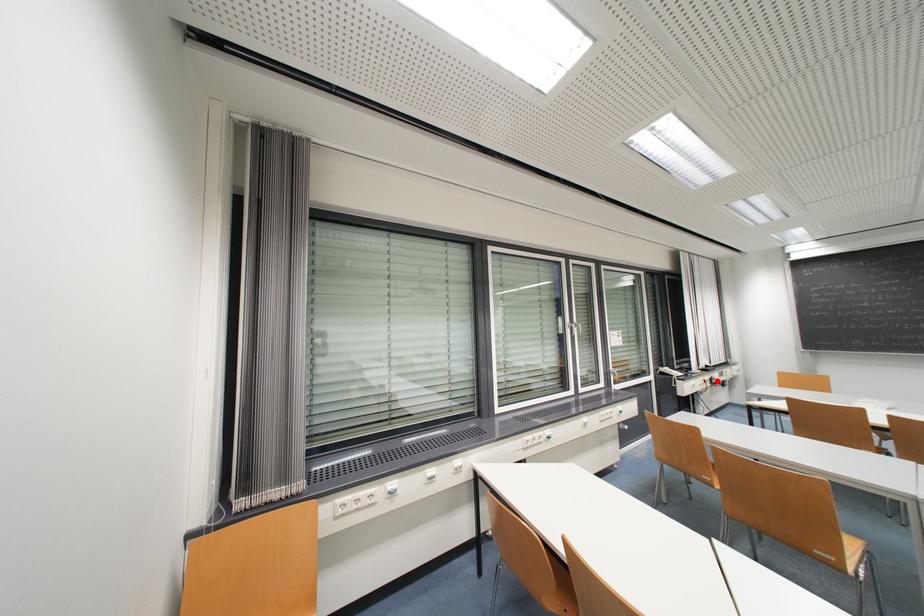
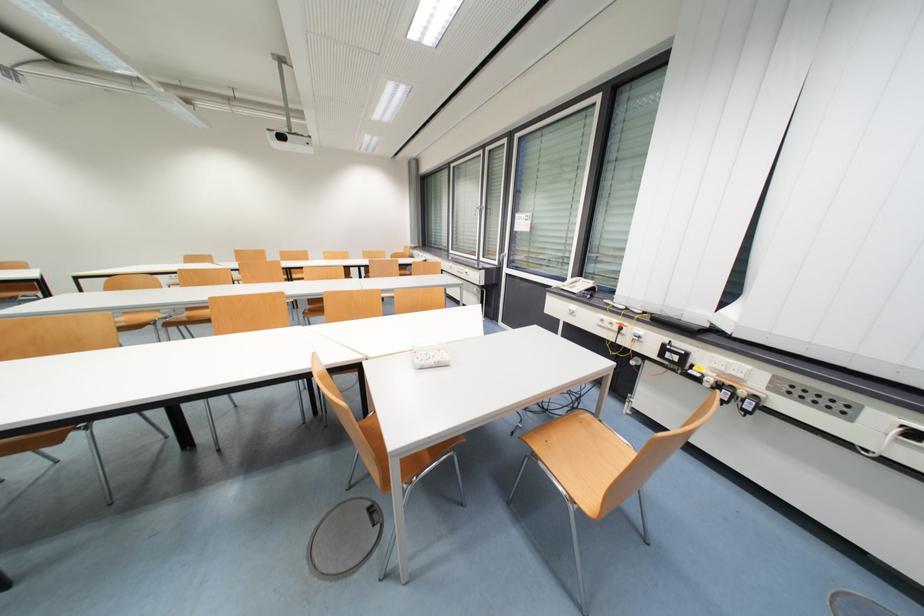
Question: I am providing you with two images of the same scene from different viewpoints. In image1, a red point is highlighted. Considering the same 3D point in image2, which of the following is correct?

Choices:
 (A) It is closer
 (B) It is farther

Answer: (A)